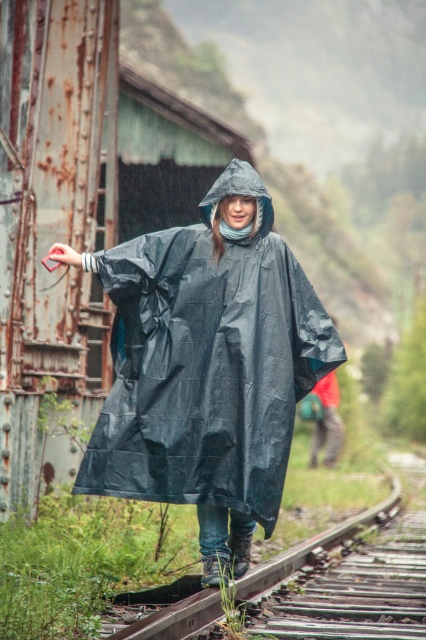
From the picture: You are trying to locate the black matte raincoat at center in the image. What are the coordinates where it is positioned?

The black matte raincoat at center is positioned at coordinates point (239, 195).

You are a photographer standing at the camera position. You want to capture a closeup shot of the brown wooden track at center. Given that your camera can focus on objects within 20 feet, will you be able to get a clear shot without moving closer?

The brown wooden track at center is 22.35 feet from the camera, which is beyond the 20 feet focusing range. Therefore, you won not be able to get a clear shot without moving closer.